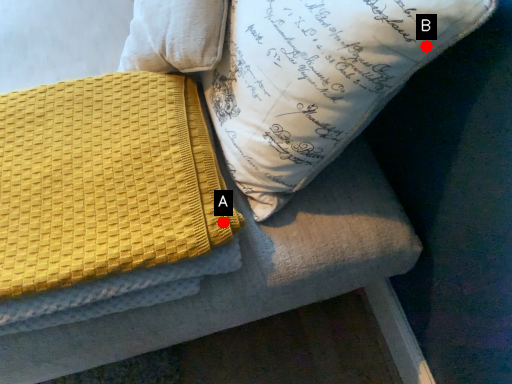
Question: Two points are circled on the image, labeled by A and B beside each circle. Which point is closer to the camera taking this photo?

Choices:
 (A) A is closer
 (B) B is closer

Answer: (B)